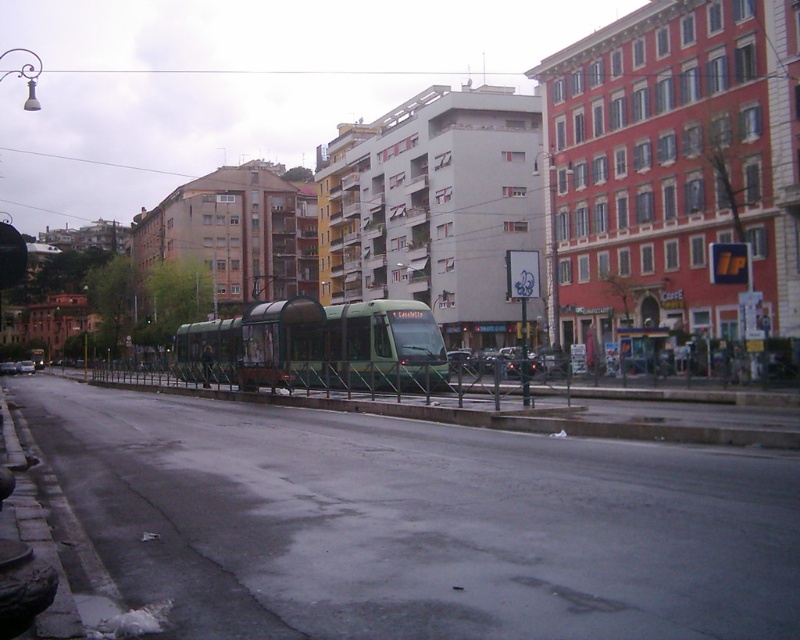
Question: Does green metallic train at center appear under metallic silver car at center?

Choices:
 (A) no
 (B) yes

Answer: (A)

Question: Does green metallic train at center appear over metallic silver car at center?

Choices:
 (A) no
 (B) yes

Answer: (B)

Question: Which object is closer to the camera taking this photo?

Choices:
 (A) metallic silver car at center
 (B) green metallic train at center

Answer: (B)

Question: Observing the image, what is the correct spatial positioning of green metallic train at center in reference to metallic silver car at center?

Choices:
 (A) right
 (B) left

Answer: (A)